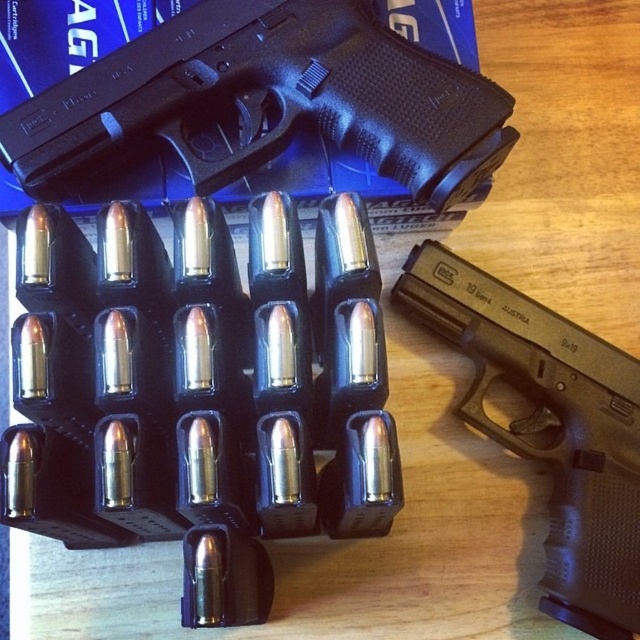
You are a firearms expert examining two handguns on a table. You have the black rubber handgun at upper center and the black plastic handgun at center. Which one is wider?

The black rubber handgun at upper center is wider than the black plastic handgun at center.

You are a security guard inspecting the display of firearms. You need to verify the positions of the black rubber handgun at upper center and the black plastic handgun at center. Which one is placed higher on the wooden surface?

The black rubber handgun at upper center is placed higher on the wooden surface than the black plastic handgun at center.